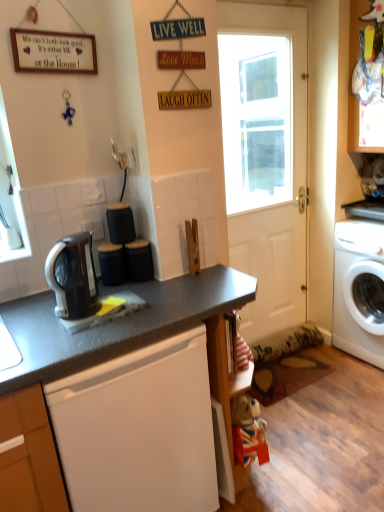
Find the location of a particular element. The width and height of the screenshot is (384, 512). empty space that is ontop of white matte door at center is located at coordinates (275, 1).